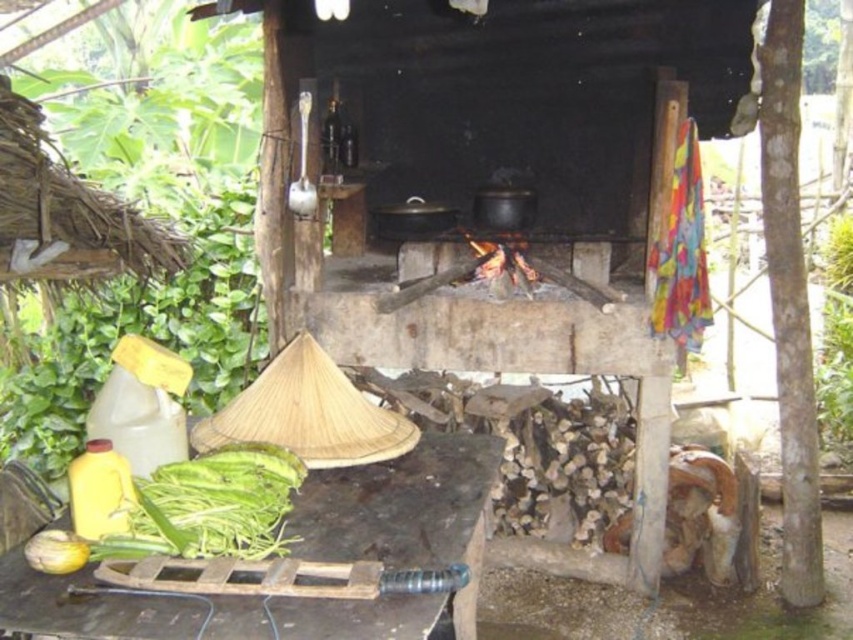
Question: In this image, where is wooden table at lower left located relative to green leafy vegetables at lower left?

Choices:
 (A) left
 (B) right

Answer: (B)

Question: Among these objects, which one is nearest to the camera?

Choices:
 (A) wooden table at lower left
 (B) green leafy vegetables at lower left

Answer: (A)

Question: Is wooden table at lower left smaller than green leafy vegetables at lower left?

Choices:
 (A) no
 (B) yes

Answer: (A)

Question: Which point appears farthest from the camera in this image?

Choices:
 (A) (215, 461)
 (B) (361, 636)

Answer: (A)

Question: Does wooden table at lower left have a lesser width compared to green leafy vegetables at lower left?

Choices:
 (A) no
 (B) yes

Answer: (A)